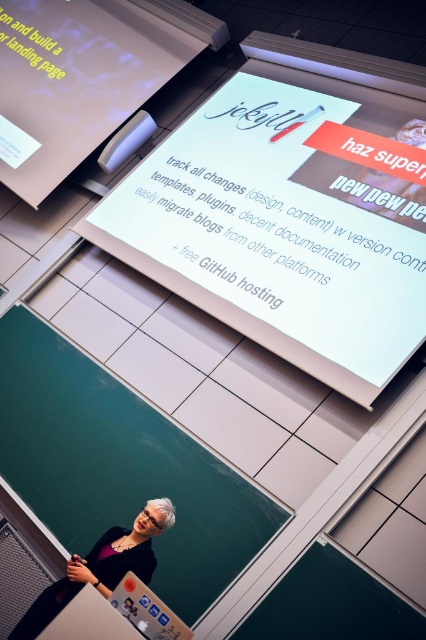
Question: Does white glossy projection screen at upper center appear over white glossy hair at center?

Choices:
 (A) yes
 (B) no

Answer: (A)

Question: Which object appears farthest from the camera in this image?

Choices:
 (A) white glossy hair at center
 (B) white paper at upper left
 (C) white glossy projection screen at upper center
 (D) white glossy projector screen at upper center

Answer: (B)

Question: Based on their relative distances, which object is nearer to the white paper at upper left?

Choices:
 (A) white glossy projection screen at upper center
 (B) white glossy projector screen at upper center
 (C) white glossy hair at center

Answer: (B)

Question: Estimate the real-world distances between objects in this image. Which object is closer to the white paper at upper left?

Choices:
 (A) white glossy projector screen at upper center
 (B) white glossy projection screen at upper center
 (C) white glossy hair at center

Answer: (A)

Question: Is white glossy projector screen at upper center to the right of white glossy hair at center from the viewer's perspective?

Choices:
 (A) yes
 (B) no

Answer: (A)

Question: Is white glossy projector screen at upper center in front of white paper at upper left?

Choices:
 (A) yes
 (B) no

Answer: (A)